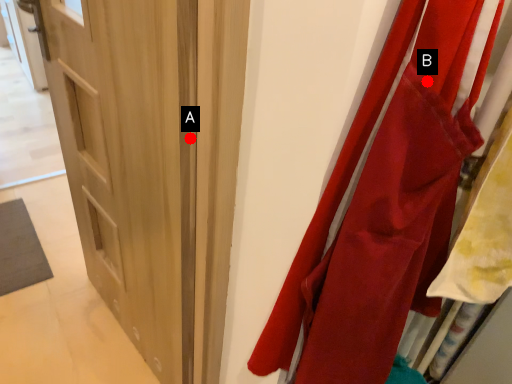
Question: Two points are circled on the image, labeled by A and B beside each circle. Which point is closer to the camera?

Choices:
 (A) A is closer
 (B) B is closer

Answer: (B)